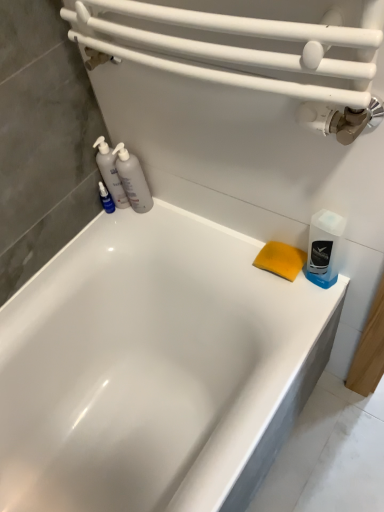
The height and width of the screenshot is (512, 384). I want to click on free space in front of translucent plastic bottles at left, placed as the 1th cleaning product when sorted from left to right, so click(137, 226).